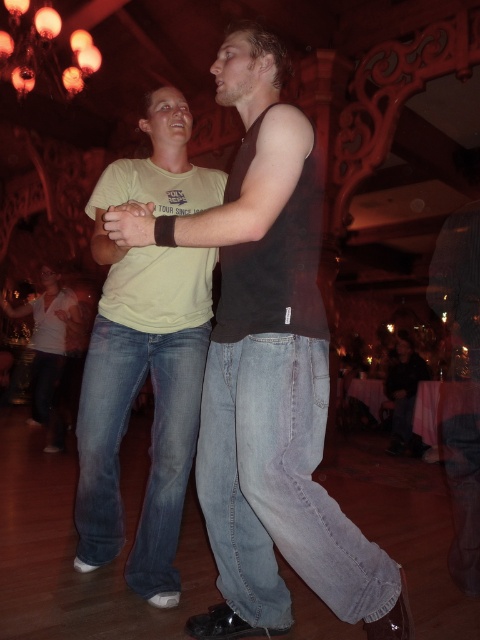
Question: Considering the real-world distances, which object is farthest from the white matte shirt at lower left?

Choices:
 (A) dark brown tank top at center
 (B) dark gray jeans at lower right

Answer: (A)

Question: Observing the image, what is the correct spatial positioning of dark brown tank top at center in reference to matte black tank top at center?

Choices:
 (A) below
 (B) above

Answer: (B)

Question: Is matte black tank top at center to the left of white matte shirt at lower left from the viewer's perspective?

Choices:
 (A) no
 (B) yes

Answer: (A)

Question: Considering the real-world distances, which object is farthest from the dark gray jeans at lower right?

Choices:
 (A) white matte shirt at lower left
 (B) dark brown tank top at center

Answer: (B)

Question: Which point appears farthest from the camera in this image?

Choices:
 (A) (240, 205)
 (B) (399, 385)
 (C) (67, 321)
 (D) (180, 259)

Answer: (B)

Question: Is dark brown tank top at center further to camera compared to white matte shirt at lower left?

Choices:
 (A) yes
 (B) no

Answer: (B)